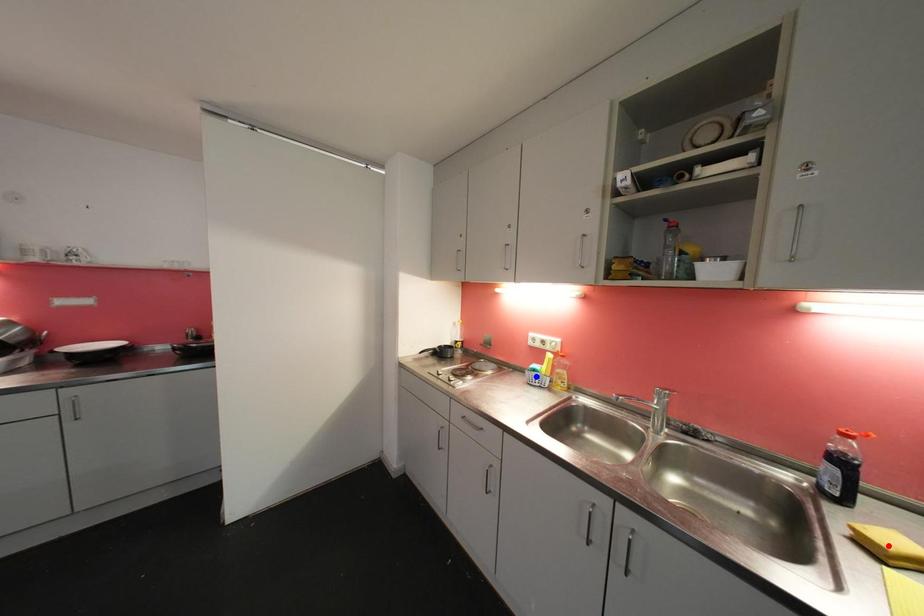
Question: In the image, two points are highlighted. Which point is nearer to the camera? Reply with the corresponding letter.

Choices:
 (A) blue point
 (B) red point

Answer: (B)